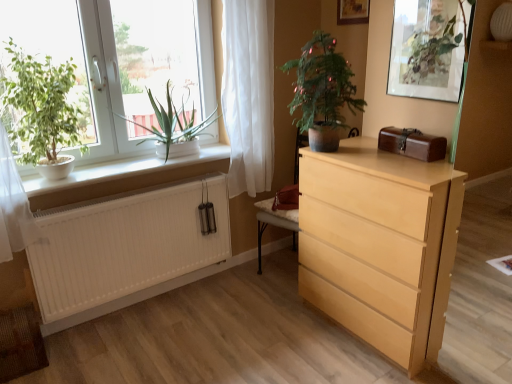
Question: Is white matte window sill at left to the right of green matte plant at left, the first houseplant viewed from the left, from the viewer's perspective?

Choices:
 (A) no
 (B) yes

Answer: (B)

Question: Can you confirm if white matte window sill at left is bigger than green matte plant at left, which is counted as the third houseplant, starting from the right?

Choices:
 (A) no
 (B) yes

Answer: (A)

Question: Can you confirm if white matte window sill at left is wider than green matte plant at left, which is counted as the third houseplant, starting from the right?

Choices:
 (A) no
 (B) yes

Answer: (A)

Question: From the image's perspective, is white matte window sill at left located beneath green matte plant at left, which is counted as the third houseplant, starting from the right?

Choices:
 (A) yes
 (B) no

Answer: (A)

Question: Is white matte window sill at left with green matte plant at left, the first houseplant viewed from the left?

Choices:
 (A) no
 (B) yes

Answer: (A)

Question: Which is correct: green matte plant at center, the 1th houseplant in the right-to-left sequence, is inside green matte plant at upper right, or outside of it?

Choices:
 (A) outside
 (B) inside

Answer: (A)

Question: Considering the positions of green matte plant at center, the 1th houseplant in the right-to-left sequence, and green matte plant at upper right in the image, is green matte plant at center, the 1th houseplant in the right-to-left sequence, wider or thinner than green matte plant at upper right?

Choices:
 (A) wide
 (B) thin

Answer: (A)

Question: Considering the relative positions of green matte plant at center, the 3th houseplant when ordered from left to right, and green matte plant at upper right in the image provided, is green matte plant at center, the 3th houseplant when ordered from left to right, to the left or to the right of green matte plant at upper right?

Choices:
 (A) left
 (B) right

Answer: (A)

Question: Is green matte plant at center, the 3th houseplant when ordered from left to right, bigger or smaller than green matte plant at upper right?

Choices:
 (A) small
 (B) big

Answer: (B)

Question: Is point (184, 236) closer or farther from the camera than point (156, 170)?

Choices:
 (A) farther
 (B) closer

Answer: (A)

Question: Considering the positions of white matte radiator at lower left and white matte window sill at left in the image, is white matte radiator at lower left taller or shorter than white matte window sill at left?

Choices:
 (A) tall
 (B) short

Answer: (A)

Question: From a real-world perspective, is white matte radiator at lower left positioned above or below white matte window sill at left?

Choices:
 (A) below
 (B) above

Answer: (A)

Question: Is white matte radiator at lower left situated inside white matte window sill at left or outside?

Choices:
 (A) outside
 (B) inside

Answer: (A)

Question: Is point (245, 102) positioned closer to the camera than point (53, 119)?

Choices:
 (A) closer
 (B) farther

Answer: (B)

Question: From the image's perspective, is white sheer curtain at upper center located above or below green matte plant at left, the first houseplant viewed from the left?

Choices:
 (A) below
 (B) above

Answer: (B)